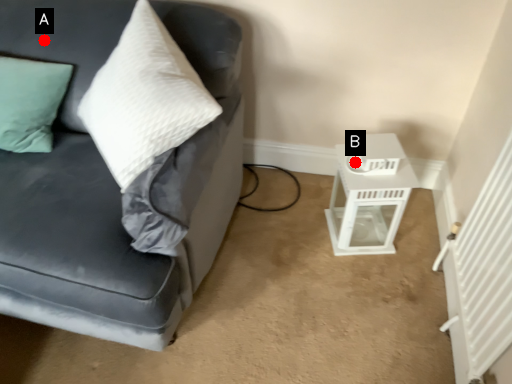
Question: Two points are circled on the image, labeled by A and B beside each circle. Among these points, which one is nearest to the camera?

Choices:
 (A) A is closer
 (B) B is closer

Answer: (A)